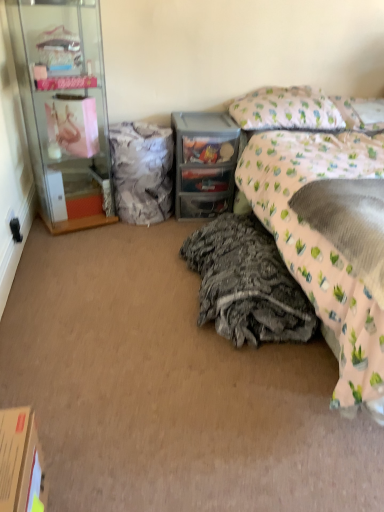
Question: Would you say translucent plastic drawer at center is outside textured gray blanket at lower center, which is the second material in left-to-right order?

Choices:
 (A) yes
 (B) no

Answer: (A)

Question: From a real-world perspective, does translucent plastic drawer at center stand above textured gray blanket at lower center, which is counted as the 1th material, starting from the right?

Choices:
 (A) no
 (B) yes

Answer: (B)

Question: Considering the relative positions of translucent plastic drawer at center and textured gray blanket at lower center, which is the second material in back-to-front order, in the image provided, is translucent plastic drawer at center to the right of textured gray blanket at lower center, which is the second material in back-to-front order, from the viewer's perspective?

Choices:
 (A) yes
 (B) no

Answer: (B)

Question: Considering the relative sizes of translucent plastic drawer at center and textured gray blanket at lower center, which ranks as the second material in top-to-bottom order, in the image provided, is translucent plastic drawer at center smaller than textured gray blanket at lower center, which ranks as the second material in top-to-bottom order,?

Choices:
 (A) no
 (B) yes

Answer: (B)

Question: Is translucent plastic drawer at center aimed at textured gray blanket at lower center, placed as the first material when sorted from front to back?

Choices:
 (A) yes
 (B) no

Answer: (A)

Question: Is point (382, 268) positioned closer to the camera than point (38, 134)?

Choices:
 (A) closer
 (B) farther

Answer: (A)

Question: In the image, is pink fabric at right on the left side or the right side of clear glass cabinet at left?

Choices:
 (A) right
 (B) left

Answer: (A)

Question: From a real-world perspective, is pink fabric at right above or below clear glass cabinet at left?

Choices:
 (A) below
 (B) above

Answer: (A)

Question: Do you think pink fabric at right is within clear glass cabinet at left, or outside of it?

Choices:
 (A) inside
 (B) outside

Answer: (B)

Question: In terms of size, does black plastic power outlet at lower left appear bigger or smaller than white textured fabric at center, the first material positioned from the top?

Choices:
 (A) small
 (B) big

Answer: (A)

Question: From a real-world perspective, is black plastic power outlet at lower left positioned above or below white textured fabric at center, which appears as the 2th material when viewed from the right?

Choices:
 (A) below
 (B) above

Answer: (A)

Question: Is black plastic power outlet at lower left wider or thinner than white textured fabric at center, which is the second material in front-to-back order?

Choices:
 (A) thin
 (B) wide

Answer: (A)

Question: Is point (18, 227) positioned closer to the camera than point (158, 219)?

Choices:
 (A) farther
 (B) closer

Answer: (B)

Question: Is textured gray blanket at lower center, placed as the first material when sorted from front to back, taller or shorter than pink fabric at right?

Choices:
 (A) short
 (B) tall

Answer: (B)

Question: Considering their positions, is textured gray blanket at lower center, which is counted as the 1th material, starting from the right, located in front of or behind pink fabric at right?

Choices:
 (A) behind
 (B) front

Answer: (A)